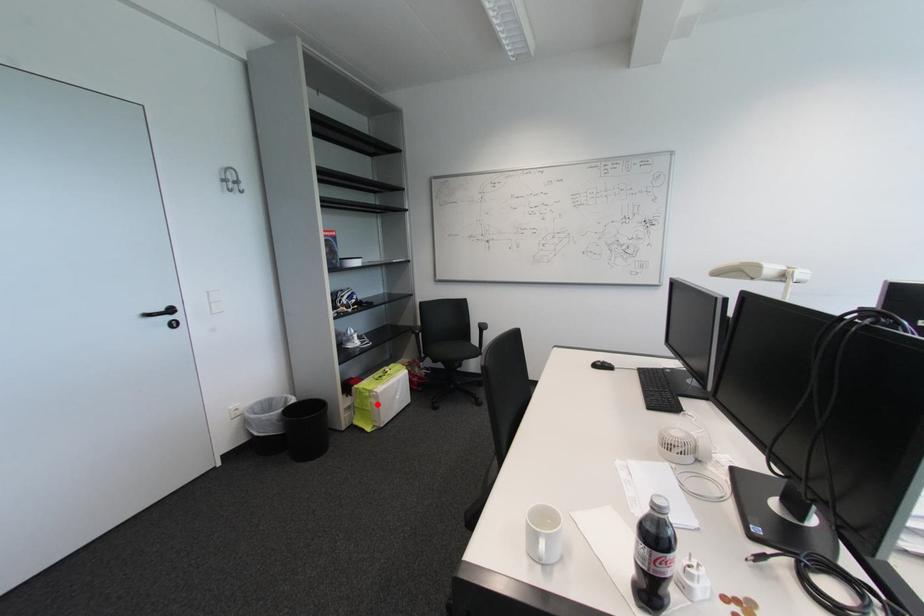
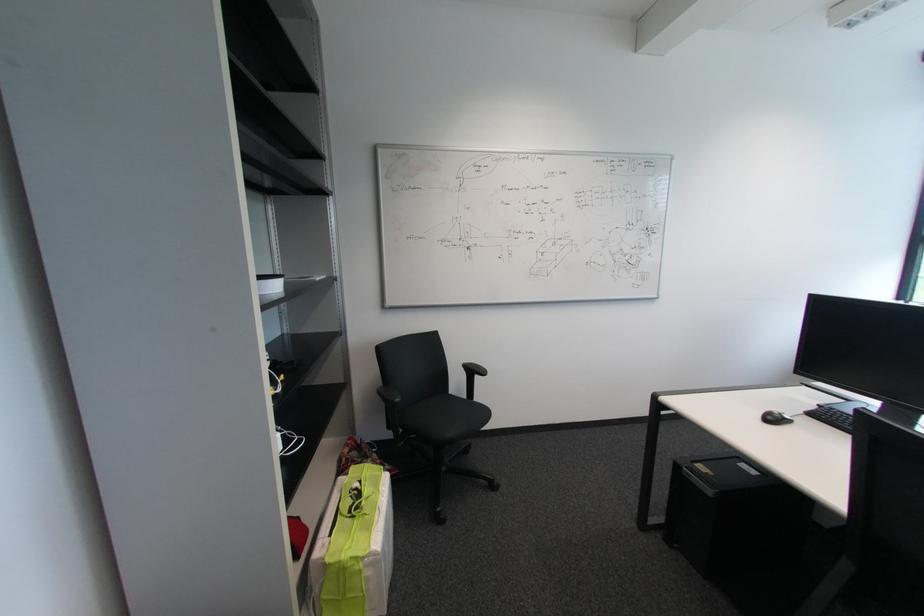
Question: I am providing you with two images of the same scene from different viewpoints. In image1, a red point is highlighted. Considering the same 3D point in image2, which of the following is correct?

Choices:
 (A) It is closer
 (B) It is farther

Answer: (A)